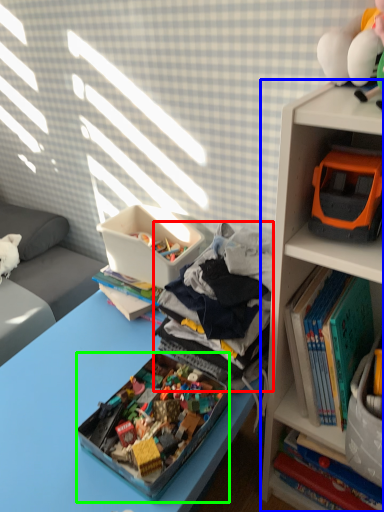
Question: Which is nearer to the clothing (highlighted by a red box)? bookcase (highlighted by a blue box) or box (highlighted by a green box).

Choices:
 (A) bookcase
 (B) box

Answer: (A)